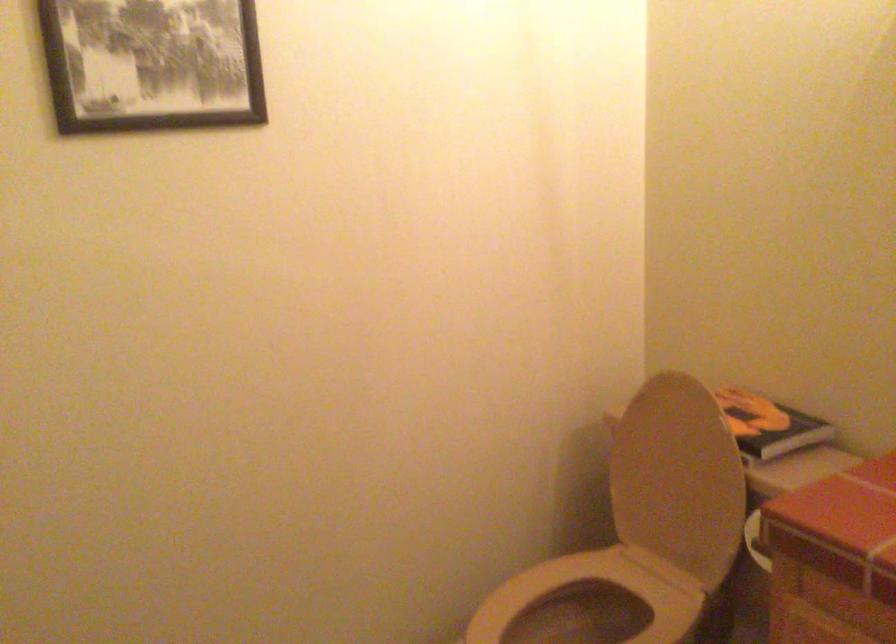
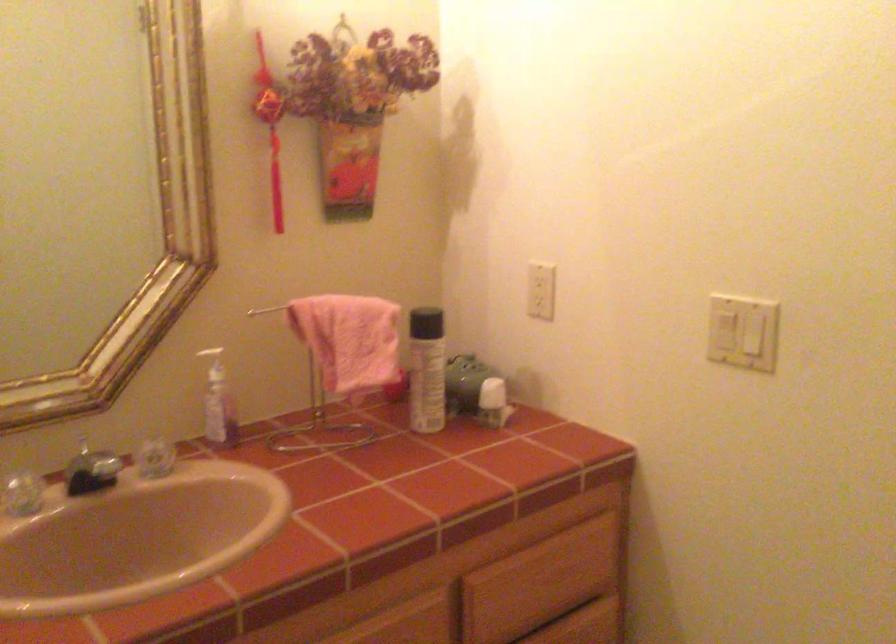
Question: The first image is from the beginning of the video and the second image is from the end. How did the camera likely rotate when shooting the video?

Choices:
 (A) Left
 (B) Right
 (C) Up
 (D) Down

Answer: (B)